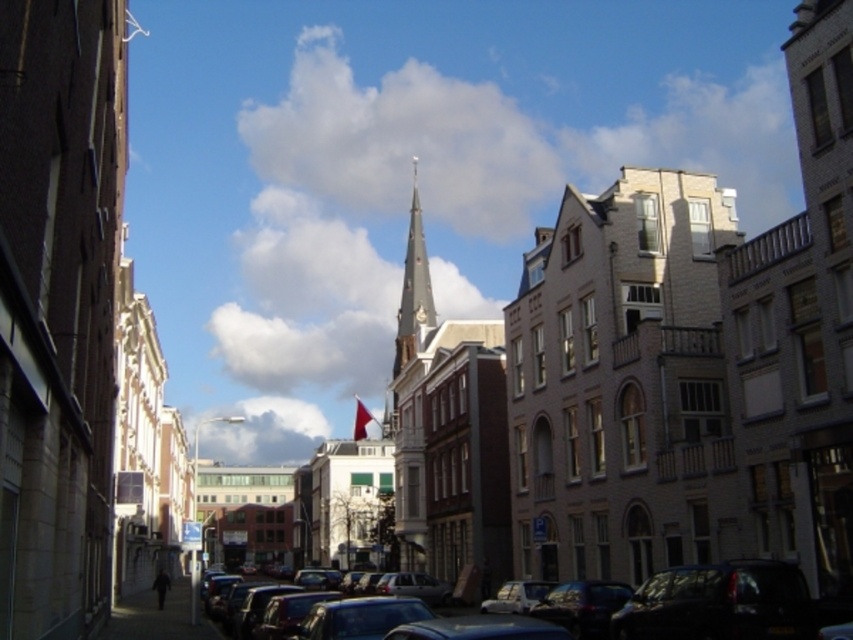
In the scene shown: Based on the scene description, where is the light beige stone church at center located in the image coordinates?

The light beige stone church at center is located at point coordinates of (619, 380).

You are a tourist standing on the street and want to take a photo of the light beige stone church at center and the red fabric flag at center. Which object should you focus on first if you want to capture both in a single frame without moving your camera?

The light beige stone church at center is shorter than the red fabric flag at center, so you should focus on the red fabric flag at center first to ensure both are in frame.